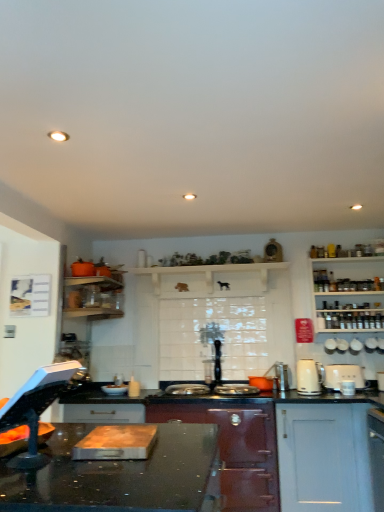
The height and width of the screenshot is (512, 384). I want to click on vacant region above white wooden shelves at right (from a real-world perspective), so click(x=352, y=247).